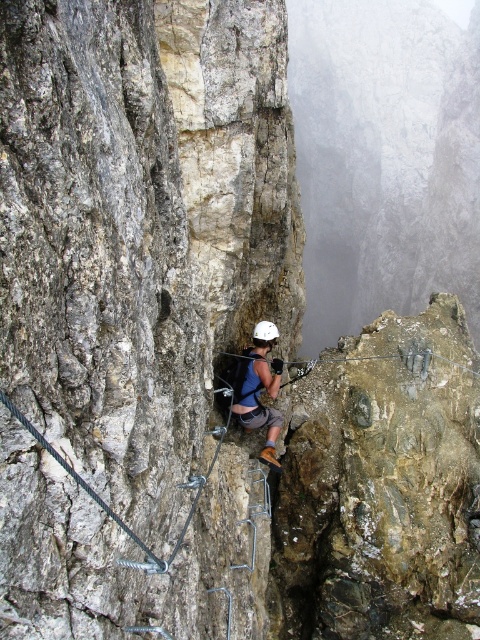
You are a safety inspector checking the climbing setup. You notice the gray rock at center and the blue fabric helmet at center. Which object is located higher up on the cliff face?

The gray rock at center is positioned over the blue fabric helmet at center, so the gray rock at center is higher up on the cliff face.

You are standing at the base of the cliff and want to reach the point marked as point [233,406]. If your climbing gear can handle a maximum distance of 10 meters, will you be able to safely reach that point?

The distance of point [233,406] from the viewer is 10.28 meters, which exceeds the gear limit of 10 meters. Therefore, you cannot safely reach that point with your current equipment.